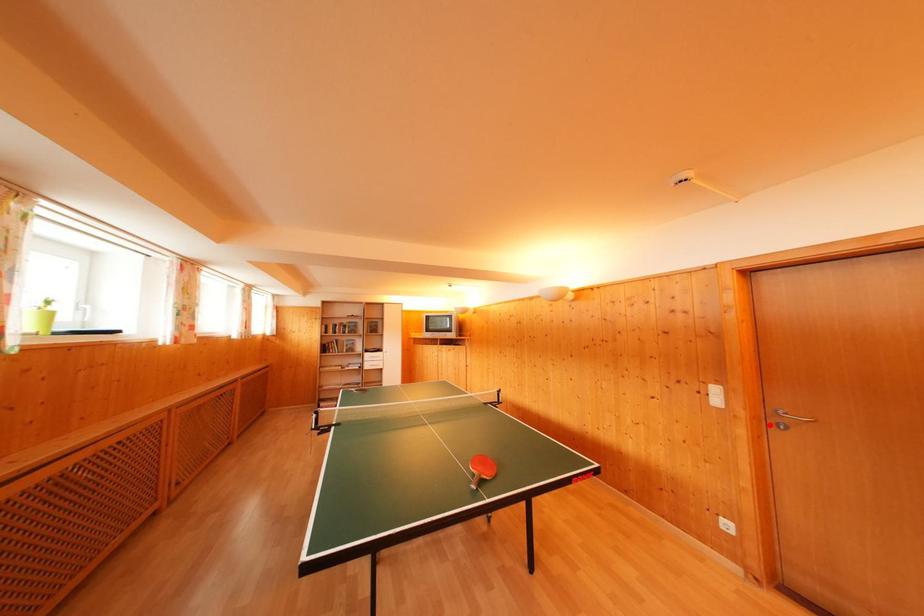
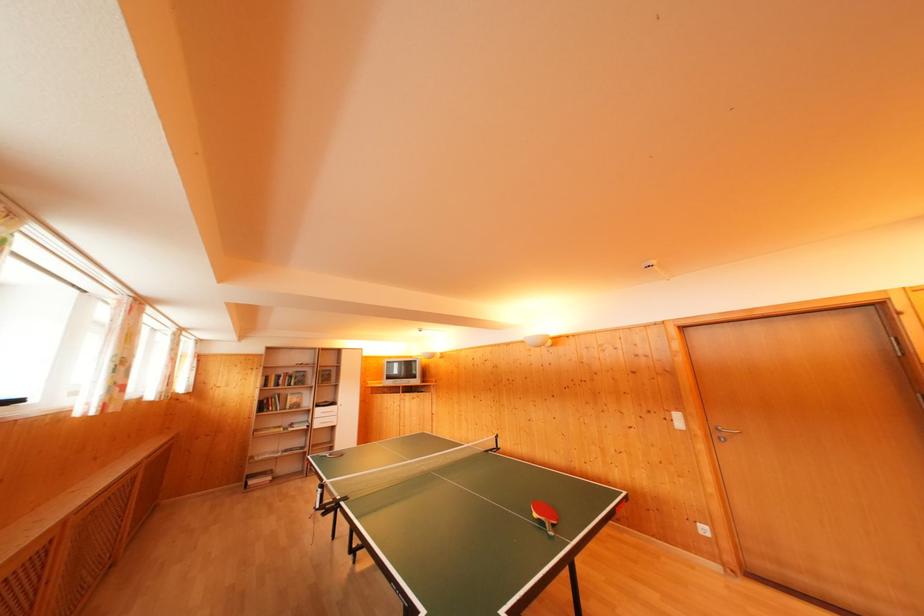
Locate, in the second image, the point that corresponds to the highlighted location in the first image.

(718, 440)